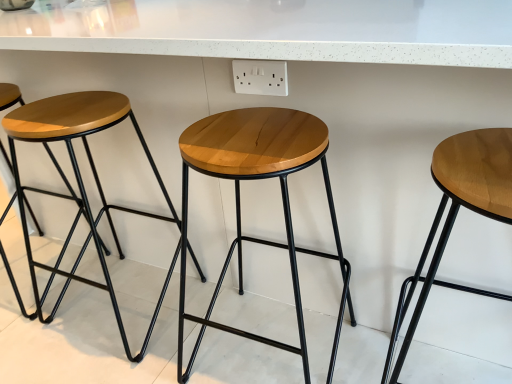
This screenshot has width=512, height=384. What are the coordinates of `vacant point above natural wood stool at center, the second stool positioned from the right (from a real-world perspective)` in the screenshot? It's located at (257, 132).